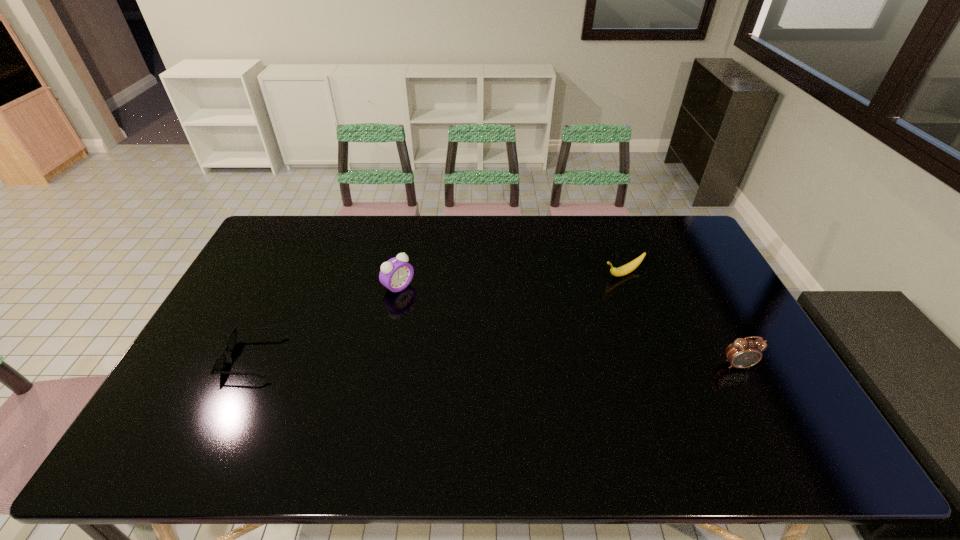
Where is `free space between the nearer alarm clock and the leftmost object`? The width and height of the screenshot is (960, 540). free space between the nearer alarm clock and the leftmost object is located at coordinates (495, 361).

Identify the location of free space between the rightmost object and the left alarm clock. The height and width of the screenshot is (540, 960). (568, 326).

Locate an element on the screen. The width and height of the screenshot is (960, 540). vacant area that lies between the sunglasses and the farther alarm clock is located at coordinates (326, 322).

Select which object is the third closest to the sunglasses. Please provide its 2D coordinates. Your answer should be formatted as a tuple, i.e. [(x, y)], where the tuple contains the x and y coordinates of a point satisfying the conditions above.

[(743, 353)]

Locate which object ranks second in proximity to the third object from left to right. Please provide its 2D coordinates. Your answer should be formatted as a tuple, i.e. [(x, y)], where the tuple contains the x and y coordinates of a point satisfying the conditions above.

[(396, 274)]